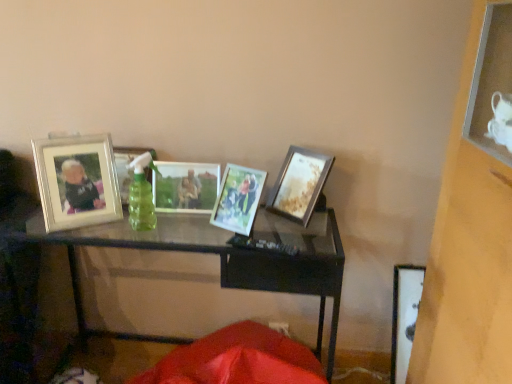
Question: Is metallic silver photo frame at center, which is the 3th picture frame from left to right, positioned with its back to metallic silver photo frame at center, the second picture frame positioned from the right?

Choices:
 (A) yes
 (B) no

Answer: (B)

Question: From the image's perspective, is metallic silver photo frame at center, positioned as the 3th picture frame in right-to-left order, located above metallic silver photo frame at center, the second picture frame positioned from the right?

Choices:
 (A) no
 (B) yes

Answer: (B)

Question: Considering the relative sizes of metallic silver photo frame at center, which is the 3th picture frame from left to right, and metallic silver photo frame at center, which is the fourth picture frame from left to right, in the image provided, is metallic silver photo frame at center, which is the 3th picture frame from left to right, taller than metallic silver photo frame at center, which is the fourth picture frame from left to right,?

Choices:
 (A) yes
 (B) no

Answer: (A)

Question: Is metallic silver photo frame at center, which is the fourth picture frame from left to right, completely or partially inside metallic silver photo frame at center, positioned as the 3th picture frame in right-to-left order?

Choices:
 (A) yes
 (B) no

Answer: (B)

Question: From a real-world perspective, is metallic silver photo frame at center, which is the 3th picture frame from left to right, beneath metallic silver photo frame at center, the second picture frame positioned from the right?

Choices:
 (A) yes
 (B) no

Answer: (B)

Question: Is metallic silver photo frame at center, positioned as the 3th picture frame in right-to-left order, taller or shorter than metallic silver photo frame at center, the second picture frame positioned from the right?

Choices:
 (A) short
 (B) tall

Answer: (B)

Question: In the image, is metallic silver photo frame at center, positioned as the 3th picture frame in right-to-left order, on the left side or the right side of metallic silver photo frame at center, the second picture frame positioned from the right?

Choices:
 (A) left
 (B) right

Answer: (A)

Question: From a real-world perspective, is metallic silver photo frame at center, positioned as the 3th picture frame in right-to-left order, positioned above or below metallic silver photo frame at center, which is the fourth picture frame from left to right?

Choices:
 (A) below
 (B) above

Answer: (B)

Question: Is metallic silver photo frame at center, which is the 3th picture frame from left to right, inside the boundaries of metallic silver photo frame at center, the second picture frame positioned from the right, or outside?

Choices:
 (A) outside
 (B) inside

Answer: (A)

Question: Considering their positions, is silver metallic photo frame at left, arranged as the first picture frame when viewed from the left, located in front of or behind wooden photo frame at center, the fifth picture frame positioned from the left?

Choices:
 (A) front
 (B) behind

Answer: (A)

Question: Is silver metallic photo frame at left, arranged as the fifth picture frame when viewed from the right, to the left or to the right of wooden photo frame at center, the fifth picture frame positioned from the left, in the image?

Choices:
 (A) left
 (B) right

Answer: (A)

Question: Looking at their shapes, would you say silver metallic photo frame at left, arranged as the fifth picture frame when viewed from the right, is wider or thinner than wooden photo frame at center, the fifth picture frame positioned from the left?

Choices:
 (A) thin
 (B) wide

Answer: (B)

Question: Considering the positions of point (39, 155) and point (269, 198), is point (39, 155) closer or farther from the camera than point (269, 198)?

Choices:
 (A) closer
 (B) farther

Answer: (A)

Question: Visually, is black glass table at center positioned to the left or to the right of silver metallic photo frame at left, arranged as the first picture frame when viewed from the left?

Choices:
 (A) left
 (B) right

Answer: (B)

Question: Looking at their shapes, would you say black glass table at center is wider or thinner than silver metallic photo frame at left, arranged as the fifth picture frame when viewed from the right?

Choices:
 (A) wide
 (B) thin

Answer: (A)